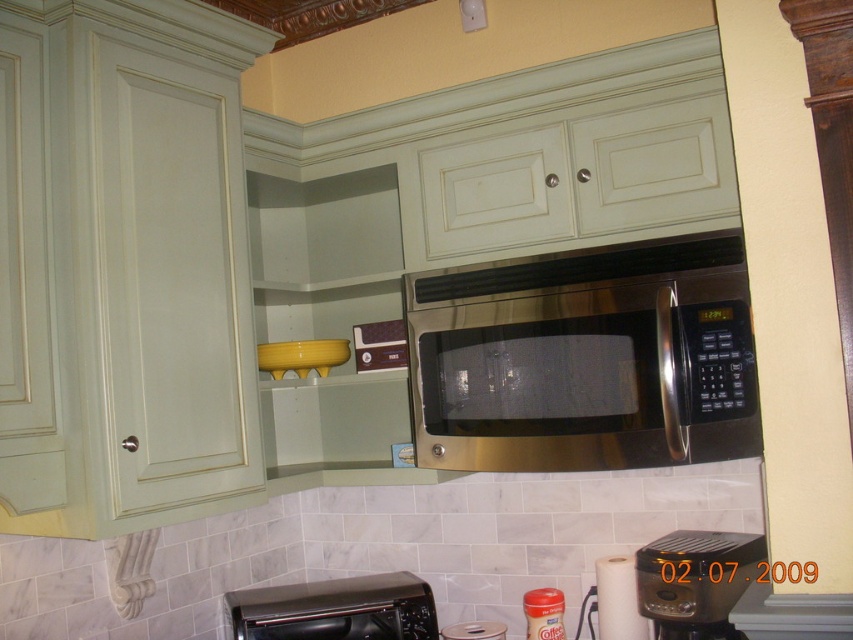
Between point (280, 632) and point (679, 593), which one is positioned behind?

The point (280, 632) is behind.

Consider the image. Which is more to the right, black plastic toaster oven at lower center or black plastic coffee maker at lower center?

black plastic coffee maker at lower center is more to the right.

Identify the location of black plastic toaster oven at lower center. The image size is (853, 640). (335, 609).

Between stainless steel microwave at center and black plastic coffee maker at lower center, which one has less height?

With less height is black plastic coffee maker at lower center.

Between stainless steel microwave at center and black plastic coffee maker at lower center, which one has more height?

stainless steel microwave at center is taller.

This screenshot has height=640, width=853. Describe the element at coordinates (585, 358) in the screenshot. I see `stainless steel microwave at center` at that location.

Where is `stainless steel microwave at center`? stainless steel microwave at center is located at coordinates 585,358.

What do you see at coordinates (585, 358) in the screenshot?
I see `stainless steel microwave at center` at bounding box center [585, 358].

Does point (666, 330) come closer to viewer compared to point (277, 602)?

Yes.

In order to click on stainless steel microwave at center in this screenshot , I will do `click(585, 358)`.